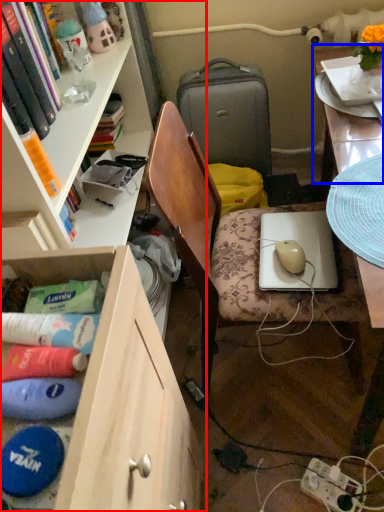
Question: Which object appears closest to the camera in this image, cabinetry (highlighted by a red box) or table top (highlighted by a blue box)?

Choices:
 (A) cabinetry
 (B) table top

Answer: (A)